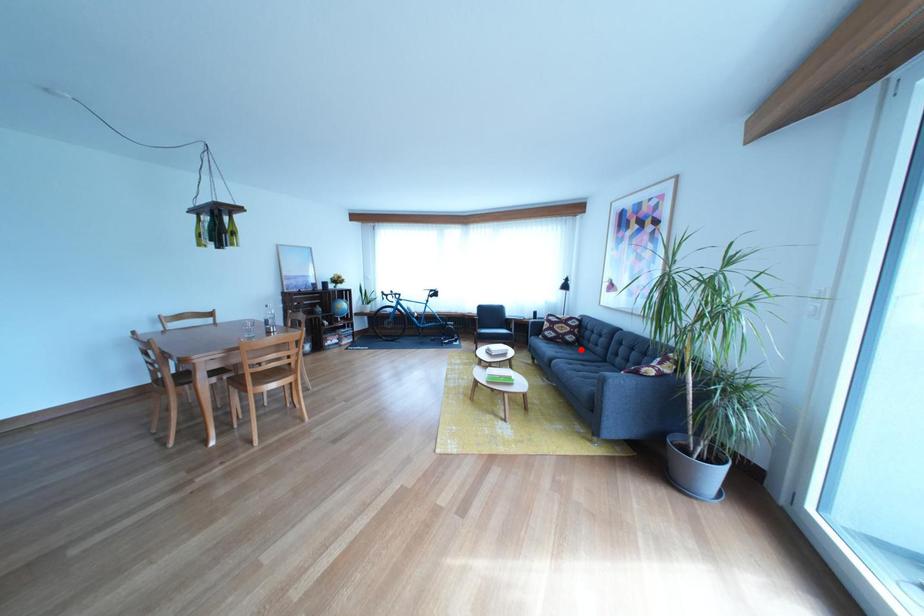
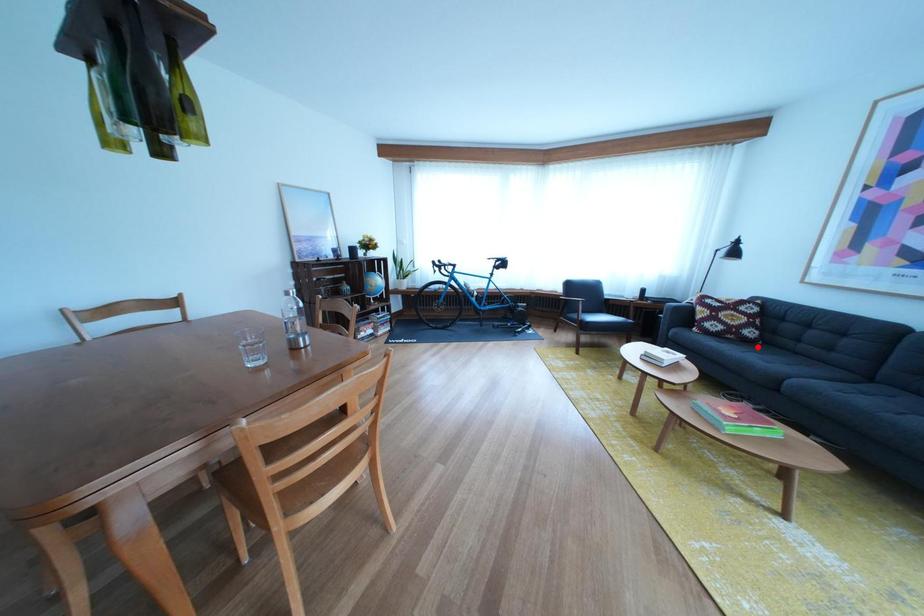
I am providing you with two images of the same scene from different viewpoints. A red point is marked on the first image and another point is marked on the second image. Do the highlighted points in image1 and image2 indicate the same real-world spot?

Yes